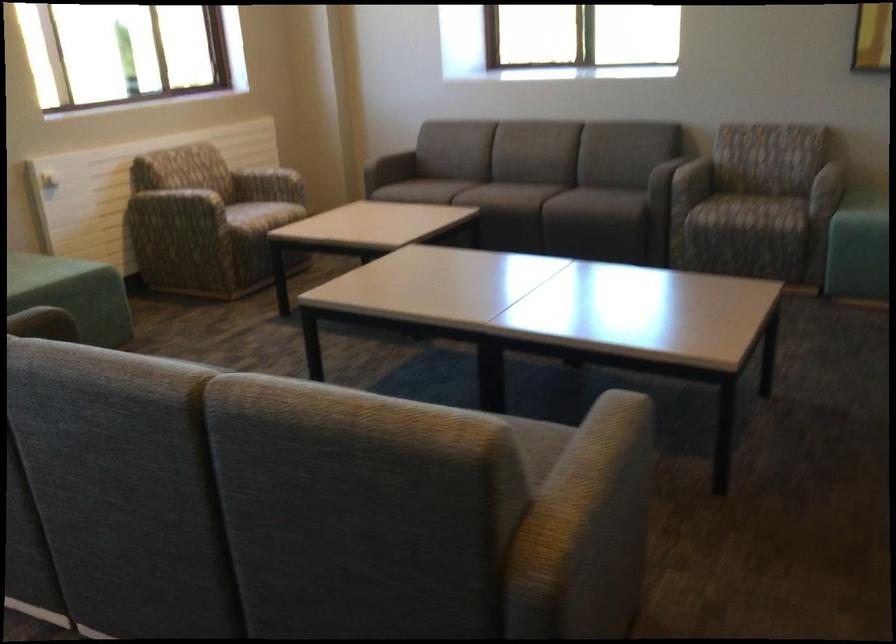
I want to click on patterned soft armrest, so click(179, 204).